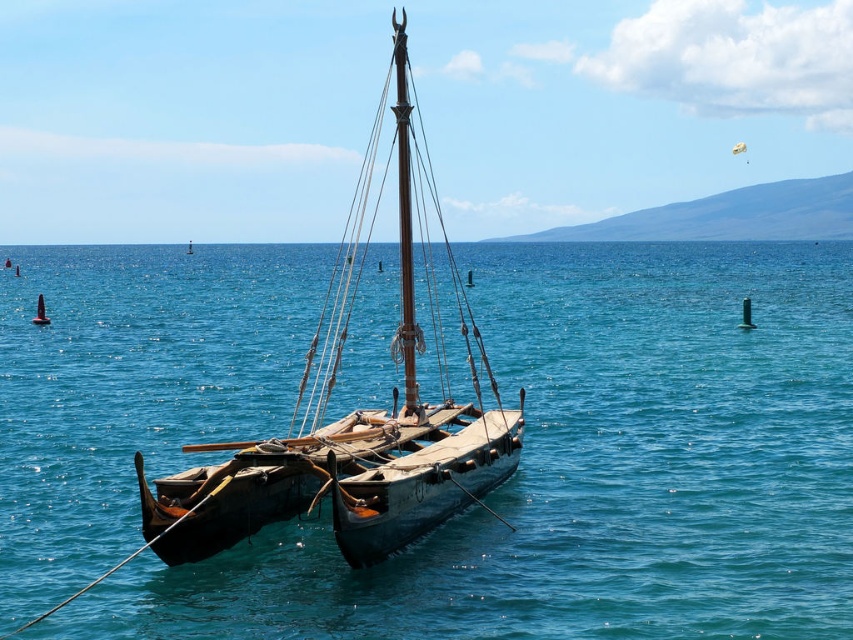
You are a marine biologist observing two boats in the water. You have a drone that can fly 15 meters. Can your drone reach from the transparent wooden boat at center to the wooden sailboat at center?

The transparent wooden boat at center and wooden sailboat at center are 16.41 meters apart from each other. Since the drone can only fly 15 meters, it cannot reach the wooden sailboat at center from the transparent wooden boat at center.

You are a marine biologist observing the traditional wooden sailboat at center and the transparent wooden boat at center from a nearby island. Which boat is closer to the water surface?

The transparent wooden boat at center is located below the wooden sailboat at center, so it is closer to the water surface.

You are an observer on a sunny day looking at the scene. There are two boats in the water, a transparent wooden boat at center and a wooden sailboat at center. Which one do you think is larger?

The transparent wooden boat at center is bigger than the wooden sailboat at center according to the description provided.